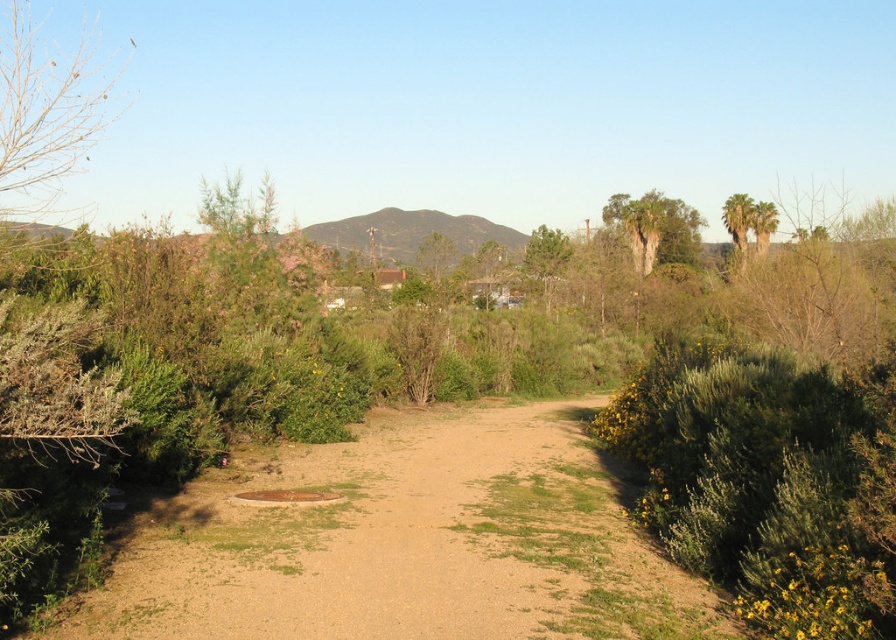
You are a hiker standing on the dirt path and want to take a photo of both the green leafy bush at right and the green textured palm tree at upper right. Which object should you focus on first to ensure both are in clear view?

You should focus on the green leafy bush at right first because it is closer to you than the green textured palm tree at upper right, ensuring both are in focus when using a camera with depth of field considerations.

You are a hiker standing on the dirt path and want to take a photo of the green leafy bush at right and the bare branches at upper left. Which object is closer to the camera?

The green leafy bush at right is positioned under the bare branches at upper left, so the green leafy bush at right is closer to the camera than the bare branches at upper left.

You are a hiker planning to set up a tent in this area. You want to choose a spot that is under the tallest object to avoid direct sunlight. Which object between the bare branches at upper left and the green textured palm tree at upper right should you position your tent under?

The bare branches at upper left are taller than the green textured palm tree at upper right, so you should position your tent under the bare branches at upper left to avoid direct sunlight.